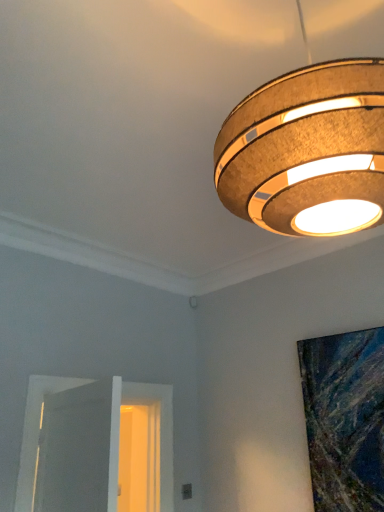
Measure the distance between point (x=150, y=468) and camera.

2.94 meters.

You are a GUI agent. You are given a task and a screenshot of the screen. Output one action in this format:
    pyautogui.click(x=<x>, y=<y>)
    Task: Click on the white wooden door at lower left
    Image resolution: width=384 pixels, height=512 pixels.
    Given the screenshot: What is the action you would take?
    pyautogui.click(x=96, y=446)

What do you see at coordinates (96, 446) in the screenshot?
I see `white wooden door at lower left` at bounding box center [96, 446].

Describe the element at coordinates (299, 139) in the screenshot. I see `textured cork lampshade at upper right` at that location.

At what (x,y) coordinates should I click in order to perform the action: click on textured cork lampshade at upper right. Please return your answer as a coordinate pair (x, y). Looking at the image, I should click on (299, 139).

Find the location of a particular element. white wooden door at lower left is located at coordinates (96, 446).

Considering the relative positions of textured cork lampshade at upper right and white wooden door at lower left in the image provided, is textured cork lampshade at upper right to the right of white wooden door at lower left from the viewer's perspective?

Indeed, textured cork lampshade at upper right is positioned on the right side of white wooden door at lower left.

Which is in front, textured cork lampshade at upper right or white wooden door at lower left?

Positioned in front is textured cork lampshade at upper right.

Which point is more distant from viewer, (325, 88) or (151, 422)?

Positioned behind is point (151, 422).

From the image's perspective, which one is positioned higher, textured cork lampshade at upper right or white wooden door at lower left?

textured cork lampshade at upper right appears higher in the image.

From a real-world perspective, is textured cork lampshade at upper right beneath white wooden door at lower left?

No, from a real-world perspective, textured cork lampshade at upper right is not below white wooden door at lower left.

Can you confirm if textured cork lampshade at upper right is thinner than white wooden door at lower left?

No.

Consider the image. Who is shorter, textured cork lampshade at upper right or white wooden door at lower left?

With less height is white wooden door at lower left.

From the picture: Can you confirm if textured cork lampshade at upper right is smaller than white wooden door at lower left?

Indeed, textured cork lampshade at upper right has a smaller size compared to white wooden door at lower left.

From the picture: Is textured cork lampshade at upper right not inside white wooden door at lower left?

textured cork lampshade at upper right lies outside white wooden door at lower left's area.

Is textured cork lampshade at upper right touching white wooden door at lower left?

No.

Is textured cork lampshade at upper right facing away from white wooden door at lower left?

No, textured cork lampshade at upper right is not facing the opposite direction of white wooden door at lower left.

How many degrees apart are the facing directions of textured cork lampshade at upper right and white wooden door at lower left?

textured cork lampshade at upper right and white wooden door at lower left are facing 177 degrees away from each other.

Find the location of a particular element. Image resolution: width=384 pixels, height=512 pixels. lamp positioned vertically above the white wooden door at lower left (from a real-world perspective) is located at coordinates (299, 139).

Based on the photo, is white wooden door at lower left at the right side of textured cork lampshade at upper right?

Incorrect, white wooden door at lower left is not on the right side of textured cork lampshade at upper right.

Is the depth of white wooden door at lower left less than that of textured cork lampshade at upper right?

No, white wooden door at lower left is behind textured cork lampshade at upper right.

Is point (168, 489) behind point (282, 147)?

Yes, point (168, 489) is farther from viewer.

From the image's perspective, which is below, white wooden door at lower left or textured cork lampshade at upper right?

white wooden door at lower left appears lower in the image.

From a real-world perspective, is white wooden door at lower left positioned over textured cork lampshade at upper right based on gravity?

Incorrect, from a real-world perspective, white wooden door at lower left is lower than textured cork lampshade at upper right.

Considering the sizes of objects white wooden door at lower left and textured cork lampshade at upper right in the image provided, who is thinner, white wooden door at lower left or textured cork lampshade at upper right?

white wooden door at lower left.

Is white wooden door at lower left taller or shorter than textured cork lampshade at upper right?

Considering their sizes, white wooden door at lower left has less height than textured cork lampshade at upper right.

From the picture: Between white wooden door at lower left and textured cork lampshade at upper right, which one has larger size?

With larger size is white wooden door at lower left.

Would you say white wooden door at lower left is inside or outside textured cork lampshade at upper right?

white wooden door at lower left exists outside the volume of textured cork lampshade at upper right.

Are white wooden door at lower left and textured cork lampshade at upper right far apart?

Absolutely, white wooden door at lower left is distant from textured cork lampshade at upper right.

Looking at this image, is white wooden door at lower left looking in the opposite direction of textured cork lampshade at upper right?

white wooden door at lower left is not turned away from textured cork lampshade at upper right.

This screenshot has height=512, width=384. What are the coordinates of `lamp located in front of the white wooden door at lower left` in the screenshot? It's located at (299, 139).

Image resolution: width=384 pixels, height=512 pixels. Identify the location of lamp in front of the white wooden door at lower left. (299, 139).

This screenshot has width=384, height=512. Identify the location of window on the left of the textured cork lampshade at upper right. (96, 446).